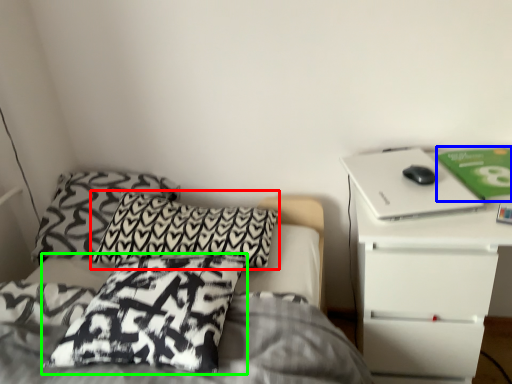
Question: Which object is positioned farthest from pillow (highlighted by a red box)? Select from paperback book (highlighted by a blue box) and pillow (highlighted by a green box).

Choices:
 (A) paperback book
 (B) pillow

Answer: (A)